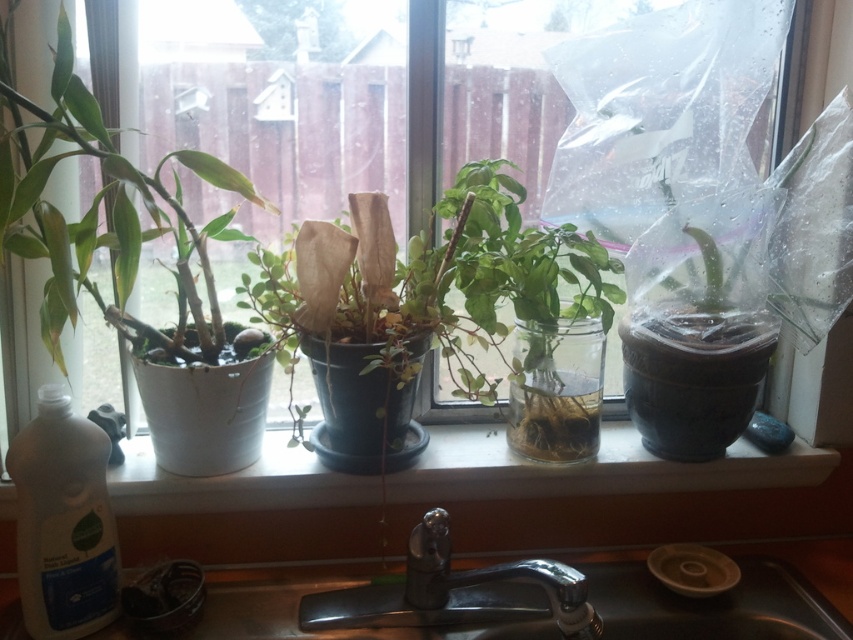
Does green matte plant at center have a greater height compared to chrome metallic faucet at lower center?

Yes, green matte plant at center is taller than chrome metallic faucet at lower center.

Who is positioned more to the right, green matte plant at center or chrome metallic faucet at lower center?

chrome metallic faucet at lower center is more to the right.

You are a GUI agent. You are given a task and a screenshot of the screen. Output one action in this format:
    pyautogui.click(x=<x>, y=<y>)
    Task: Click on the green matte plant at center
    
    Given the screenshot: What is the action you would take?
    pyautogui.click(x=428, y=291)

Who is shorter, green matte plant at center or metallic sink at lower center?

With less height is metallic sink at lower center.

In the scene shown: Is green matte plant at center positioned before metallic sink at lower center?

That is False.

Who is more distant from viewer, [328,259] or [843,573]?

Point [843,573]

Locate an element on the screen. green matte plant at center is located at coordinates (428, 291).

Can you confirm if white glossy window sill at center is smaller than chrome metallic faucet at lower center?

No.

Does white glossy window sill at center lie in front of chrome metallic faucet at lower center?

No, it is not.

Locate an element on the screen. The width and height of the screenshot is (853, 640). white glossy window sill at center is located at coordinates (590, 468).

Identify the location of white glossy window sill at center. (x=590, y=468).